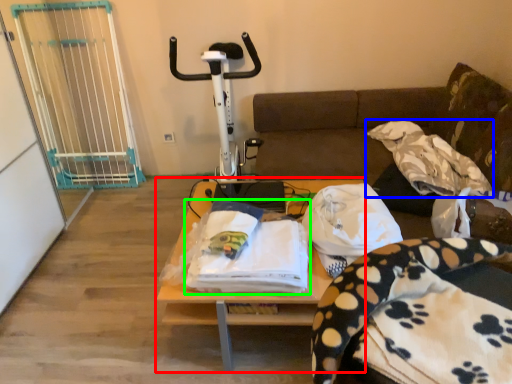
Question: Based on their relative distances, which object is farther from table (highlighted by a red box)? Choose from blanket (highlighted by a blue box) and blanket (highlighted by a green box).

Choices:
 (A) blanket
 (B) blanket

Answer: (A)